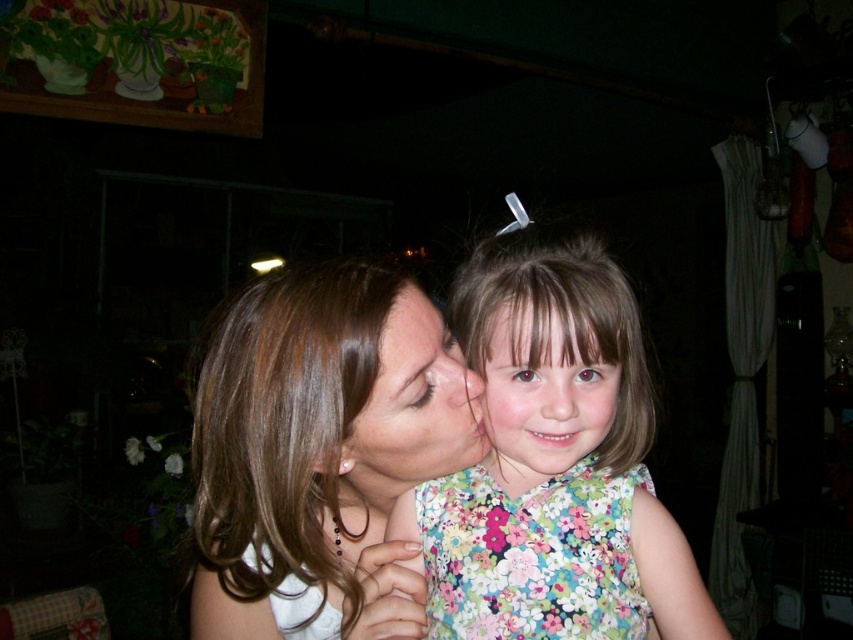
Does smooth skin face at center have a greater width compared to smooth skin forehead at center?

Yes, smooth skin face at center is wider than smooth skin forehead at center.

Does smooth skin face at center appear under smooth skin forehead at center?

Yes, smooth skin face at center is below smooth skin forehead at center.

Describe the element at coordinates (415, 403) in the screenshot. The width and height of the screenshot is (853, 640). I see `smooth skin face at center` at that location.

The image size is (853, 640). I want to click on smooth skin face at center, so click(415, 403).

Can you confirm if floral fabric dress at center is bigger than smooth skin face at center?

Correct, floral fabric dress at center is larger in size than smooth skin face at center.

Who is more distant from viewer, (676, 604) or (456, 368)?

Positioned behind is point (676, 604).

Is point (578, 369) closer to camera compared to point (445, 396)?

Yes, point (578, 369) is in front of point (445, 396).

Locate an element on the screen. The height and width of the screenshot is (640, 853). floral fabric dress at center is located at coordinates (554, 458).

The height and width of the screenshot is (640, 853). What are the coordinates of `floral fabric face at center` in the screenshot? It's located at (543, 396).

Where is `floral fabric face at center`? The width and height of the screenshot is (853, 640). floral fabric face at center is located at coordinates (543, 396).

Where is `floral fabric face at center`? Image resolution: width=853 pixels, height=640 pixels. floral fabric face at center is located at coordinates (543, 396).